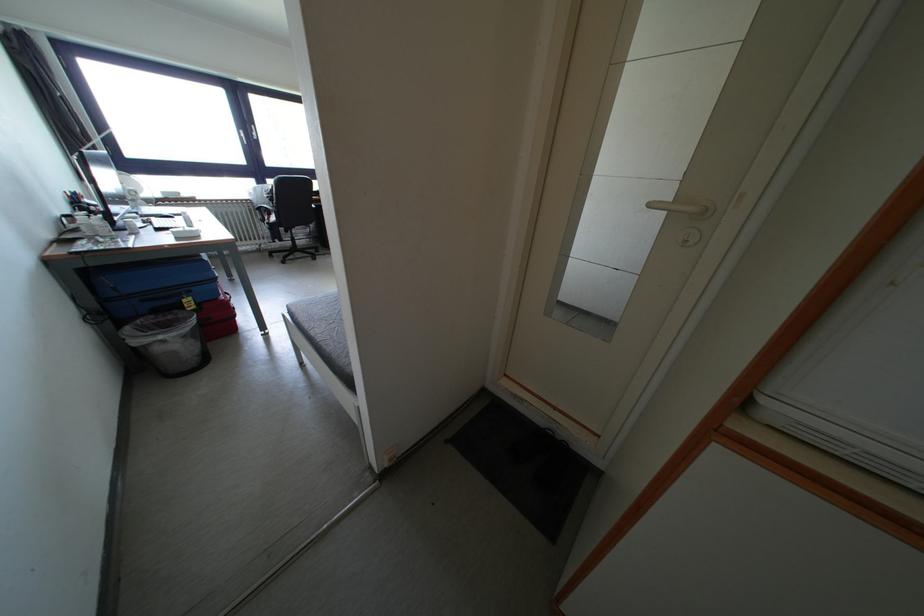
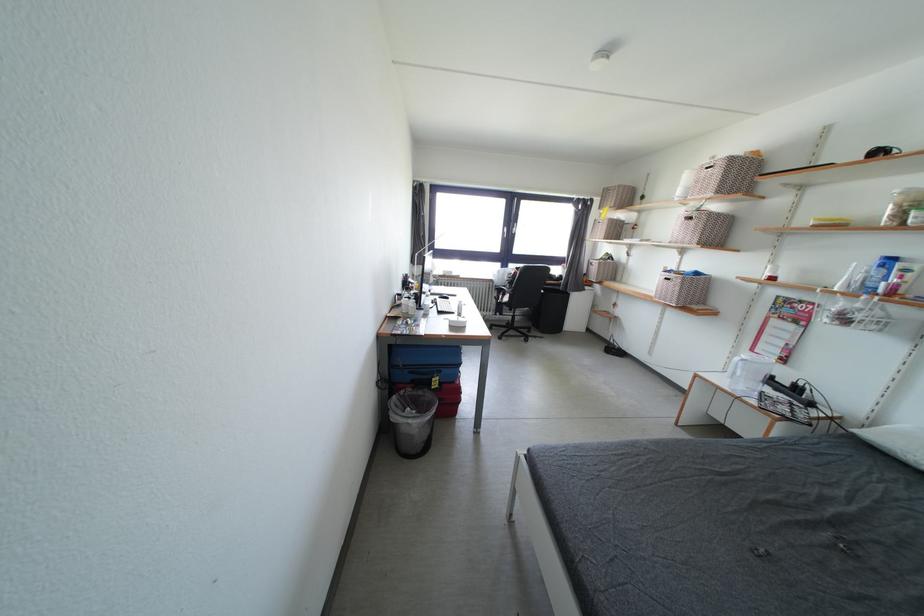
Locate, in the second image, the point that corresponds to the point at 272,187 in the first image.

(514, 270)